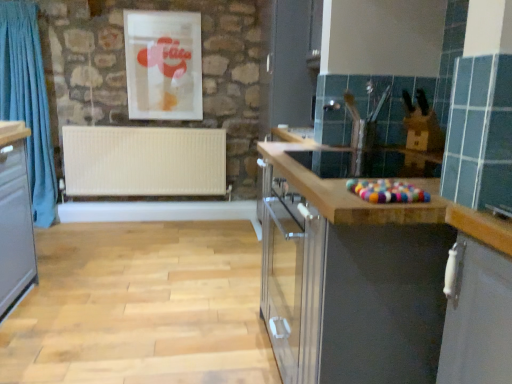
Question: Does matte plastic picture frame at upper center come in front of white matte radiator at center?

Choices:
 (A) yes
 (B) no

Answer: (A)

Question: From the image's perspective, is matte plastic picture frame at upper center over white matte radiator at center?

Choices:
 (A) yes
 (B) no

Answer: (A)

Question: Does matte plastic picture frame at upper center appear on the left side of white matte radiator at center?

Choices:
 (A) yes
 (B) no

Answer: (B)

Question: From a real-world perspective, is matte plastic picture frame at upper center physically below white matte radiator at center?

Choices:
 (A) yes
 (B) no

Answer: (B)

Question: Considering the relative sizes of matte plastic picture frame at upper center and white matte radiator at center in the image provided, is matte plastic picture frame at upper center shorter than white matte radiator at center?

Choices:
 (A) yes
 (B) no

Answer: (B)

Question: In terms of width, does white matte radiator at center look wider or thinner when compared to matte wood countertop at center?

Choices:
 (A) thin
 (B) wide

Answer: (A)

Question: From a real-world perspective, is white matte radiator at center physically located above or below matte wood countertop at center?

Choices:
 (A) above
 (B) below

Answer: (A)

Question: Considering the positions of white matte radiator at center and matte wood countertop at center in the image, is white matte radiator at center bigger or smaller than matte wood countertop at center?

Choices:
 (A) small
 (B) big

Answer: (A)

Question: From the image's perspective, is white matte radiator at center positioned above or below matte wood countertop at center?

Choices:
 (A) below
 (B) above

Answer: (B)

Question: Choose the correct answer: Is blue fabric curtain at left inside matte plastic picture frame at upper center or outside it?

Choices:
 (A) outside
 (B) inside

Answer: (A)

Question: From a real-world perspective, is blue fabric curtain at left positioned above or below matte plastic picture frame at upper center?

Choices:
 (A) above
 (B) below

Answer: (B)

Question: From the image's perspective, is blue fabric curtain at left positioned above or below matte plastic picture frame at upper center?

Choices:
 (A) above
 (B) below

Answer: (B)

Question: Is blue fabric curtain at left taller or shorter than matte plastic picture frame at upper center?

Choices:
 (A) tall
 (B) short

Answer: (A)

Question: In the image, is matte wood countertop at center on the left side or the right side of blue fabric curtain at left?

Choices:
 (A) right
 (B) left

Answer: (A)

Question: Is matte wood countertop at center inside or outside of blue fabric curtain at left?

Choices:
 (A) outside
 (B) inside

Answer: (A)